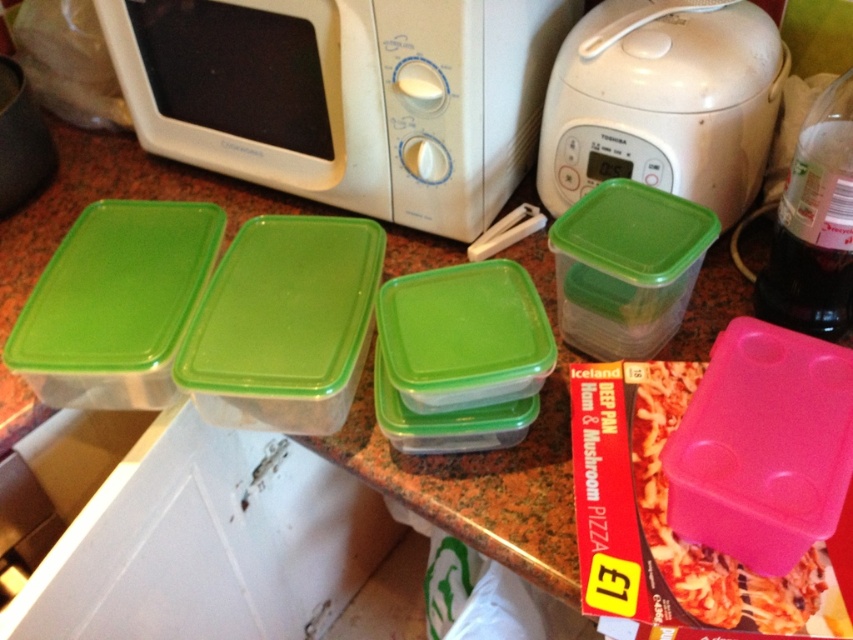
Question: Which point is farther from the camera taking this photo?

Choices:
 (A) click(x=250, y=100)
 (B) click(x=701, y=204)

Answer: (A)

Question: Is the position of white plastic microwave at upper left more distant than that of white plastic rice cooker at upper center?

Choices:
 (A) no
 (B) yes

Answer: (A)

Question: In this image, where is white plastic microwave at upper left located relative to pink plastic container at lower right?

Choices:
 (A) below
 (B) above

Answer: (B)

Question: Does white plastic rice cooker at upper center appear on the right side of pink plastic container at lower right?

Choices:
 (A) yes
 (B) no

Answer: (A)

Question: Which of the following is the closest to the observer?

Choices:
 (A) (621, 113)
 (B) (664, 385)
 (C) (431, 116)

Answer: (B)

Question: Among these objects, which one is nearest to the camera?

Choices:
 (A) white plastic rice cooker at upper center
 (B) pink plastic container at lower right
 (C) white plastic microwave at upper left

Answer: (B)